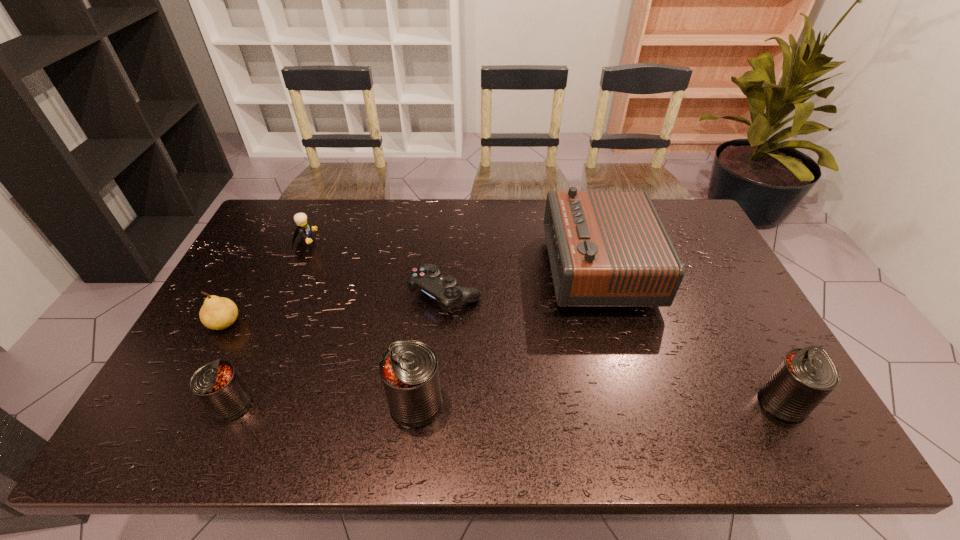
This screenshot has height=540, width=960. Find the location of `the leftmost can`. the leftmost can is located at coordinates (217, 385).

What are the coordinates of `the second can from right to left` in the screenshot? It's located at (409, 370).

In order to click on the second tallest can in this screenshot , I will do `click(805, 376)`.

Identify the location of the rightmost can. The width and height of the screenshot is (960, 540). (805, 376).

At what (x,y) coordinates should I click in order to perform the action: click on Lego. Please return your answer as a coordinate pair (x, y). The height and width of the screenshot is (540, 960). Looking at the image, I should click on click(x=304, y=228).

This screenshot has width=960, height=540. I want to click on the second object from right to left, so click(x=606, y=248).

This screenshot has height=540, width=960. Find the location of `the shortest object`. the shortest object is located at coordinates (427, 278).

This screenshot has width=960, height=540. Identify the location of pear. (217, 313).

At what (x,y) coordinates should I click in order to perform the action: click on free spot located 0.250m on the back of the leftmost can. Please return your answer as a coordinate pair (x, y). This screenshot has width=960, height=540. Looking at the image, I should click on (274, 312).

Find the location of a particular element. The image size is (960, 540). free space located on the back of the second can from left to right is located at coordinates tap(423, 342).